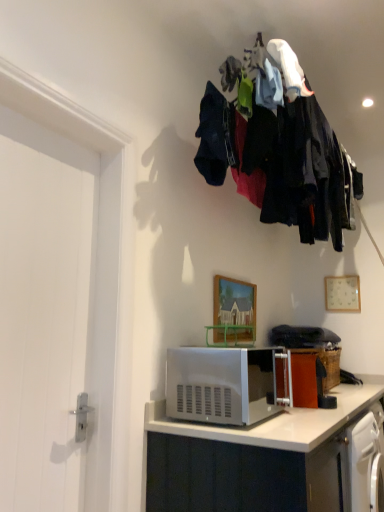
Question: Considering the relative sizes of wooden painted picture frame at center, placed as the first picture frame when sorted from front to back, and satin silver microwave at lower center in the image provided, is wooden painted picture frame at center, placed as the first picture frame when sorted from front to back, wider than satin silver microwave at lower center?

Choices:
 (A) no
 (B) yes

Answer: (A)

Question: Would you consider wooden painted picture frame at center, the first picture frame positioned from the left, to be distant from satin silver microwave at lower center?

Choices:
 (A) no
 (B) yes

Answer: (A)

Question: Does wooden painted picture frame at center, the second picture frame positioned from the back, have a larger size compared to satin silver microwave at lower center?

Choices:
 (A) yes
 (B) no

Answer: (B)

Question: Is wooden painted picture frame at center, the first picture frame positioned from the left, positioned with its back to satin silver microwave at lower center?

Choices:
 (A) yes
 (B) no

Answer: (B)

Question: Considering the relative sizes of wooden painted picture frame at center, the second picture frame positioned from the back, and satin silver microwave at lower center in the image provided, is wooden painted picture frame at center, the second picture frame positioned from the back, shorter than satin silver microwave at lower center?

Choices:
 (A) no
 (B) yes

Answer: (A)

Question: Considering the positions of point (241, 139) and point (173, 381), is point (241, 139) closer or farther from the camera than point (173, 381)?

Choices:
 (A) farther
 (B) closer

Answer: (A)

Question: Choose the correct answer: Is dark fabric clothes at upper center inside satin silver microwave at lower center or outside it?

Choices:
 (A) outside
 (B) inside

Answer: (A)

Question: In the image, is dark fabric clothes at upper center positioned in front of or behind satin silver microwave at lower center?

Choices:
 (A) behind
 (B) front

Answer: (B)

Question: Is dark fabric clothes at upper center taller or shorter than satin silver microwave at lower center?

Choices:
 (A) tall
 (B) short

Answer: (A)

Question: From the image's perspective, is white smooth door at left positioned above or below dark fabric clothes at upper center?

Choices:
 (A) below
 (B) above

Answer: (A)

Question: Relative to dark fabric clothes at upper center, is white smooth door at left in front or behind?

Choices:
 (A) behind
 (B) front

Answer: (B)

Question: From a real-world perspective, is white smooth door at left physically located above or below dark fabric clothes at upper center?

Choices:
 (A) below
 (B) above

Answer: (A)

Question: Visually, is white smooth door at left positioned to the left or to the right of dark fabric clothes at upper center?

Choices:
 (A) right
 (B) left

Answer: (B)

Question: Which is correct: wooden painted picture frame at center, the first picture frame positioned from the left, is inside satin silver microwave at lower center, or outside of it?

Choices:
 (A) outside
 (B) inside

Answer: (A)

Question: Considering the positions of wooden painted picture frame at center, the second picture frame positioned from the back, and satin silver microwave at lower center in the image, is wooden painted picture frame at center, the second picture frame positioned from the back, wider or thinner than satin silver microwave at lower center?

Choices:
 (A) wide
 (B) thin

Answer: (B)